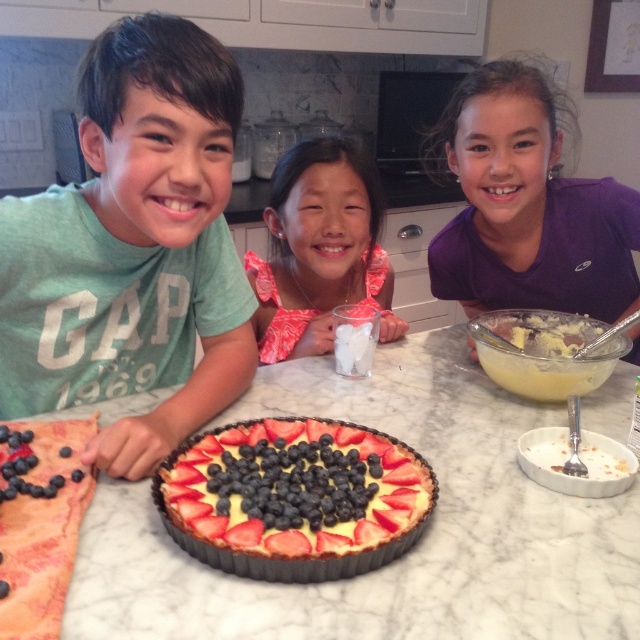
You are standing in the kitchen and want to place a new ingredient on the white marble table at center. According to the coordinates provided, where exactly should you place it?

The white marble table at center is located at point (x=410, y=556), so you should place the new ingredient there.